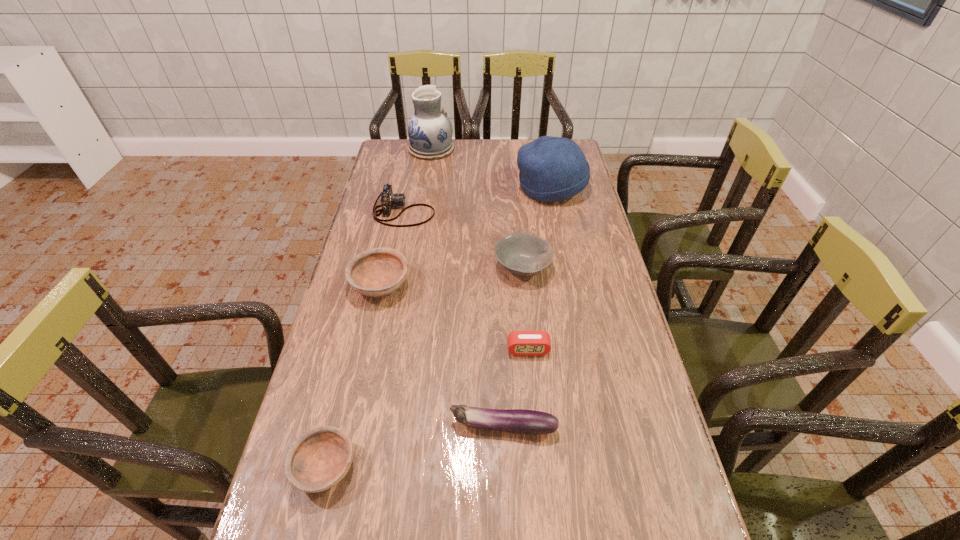
Find the location of a particular element. pottery at the left edge is located at coordinates (430, 131).

At what (x,y) coordinates should I click in order to perform the action: click on camera that is at the left edge. Please return your answer as a coordinate pair (x, y). The image size is (960, 540). Looking at the image, I should click on (388, 199).

The image size is (960, 540). Identify the location of object that is at the right edge. click(552, 169).

Locate an element on the screen. The image size is (960, 540). object that is at the far left corner is located at coordinates (430, 131).

The width and height of the screenshot is (960, 540). I want to click on free space at the far edge of the desktop, so click(x=505, y=144).

You are a GUI agent. You are given a task and a screenshot of the screen. Output one action in this format:
    pyautogui.click(x=<x>, y=<y>)
    Task: Click on the free region at the right edge
    Image resolution: width=960 pixels, height=540 pixels.
    Given the screenshot: What is the action you would take?
    pyautogui.click(x=565, y=220)

Find the location of `vacant space at the far left corner`. vacant space at the far left corner is located at coordinates (405, 139).

This screenshot has height=540, width=960. Identify the location of vacant region between the eggplant and the farther brown bowl. (442, 356).

Where is `vacant region between the camera and the gray bowl`? This screenshot has width=960, height=540. vacant region between the camera and the gray bowl is located at coordinates (464, 239).

The image size is (960, 540). What are the coordinates of `free space between the farther brown bowl and the skullcap` in the screenshot? It's located at (466, 236).